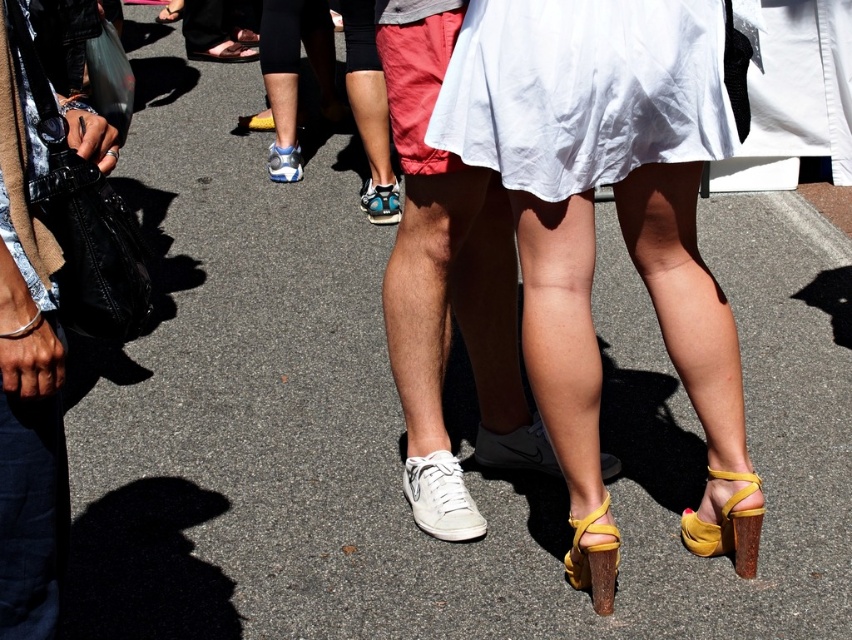
Question: Observing the image, what is the correct spatial positioning of denim pants at left in reference to matte yellow sandal at lower right?

Choices:
 (A) below
 (B) above

Answer: (B)

Question: Among these objects, which one is nearest to the camera?

Choices:
 (A) yellow leather sandal at lower right
 (B) white leather sneakers at center
 (C) white cotton dress at center

Answer: (C)

Question: Does white leather shoe at center lie in front of matte black shoe at upper center?

Choices:
 (A) yes
 (B) no

Answer: (A)

Question: Does brown wooden heel at lower center appear on the right side of matte black shoe at upper center?

Choices:
 (A) no
 (B) yes

Answer: (B)

Question: Which object is the farthest from the blue suede sneakers at center?

Choices:
 (A) white leather sneakers at center
 (B) matte yellow high-heeled sandals at center
 (C) white leather sneaker at center

Answer: (B)

Question: Among these objects, which one is nearest to the camera?

Choices:
 (A) white leather sneakers at center
 (B) matte yellow high-heeled sandals at center
 (C) yellow leather sandal at lower right

Answer: (B)